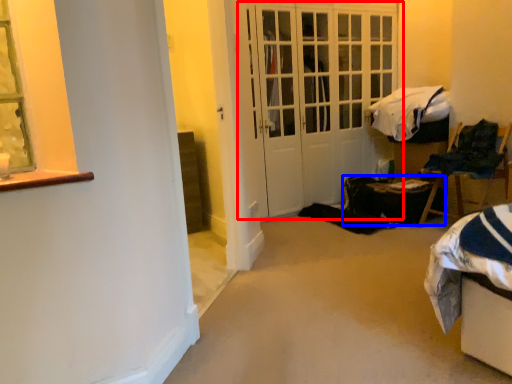
Question: Among these objects, which one is nearest to the camera, door (highlighted by a red box) or table (highlighted by a blue box)?

Choices:
 (A) door
 (B) table

Answer: (A)